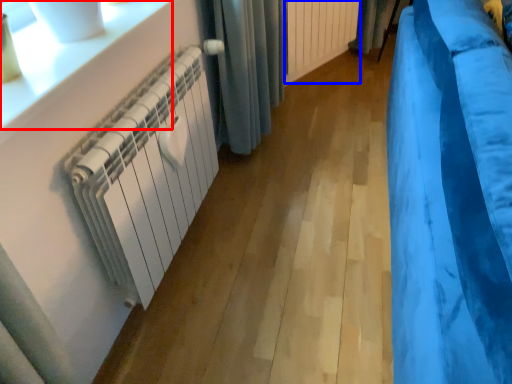
Question: Which object is closer to the camera taking this photo, window sill (highlighted by a red box) or radiator (highlighted by a blue box)?

Choices:
 (A) window sill
 (B) radiator

Answer: (A)